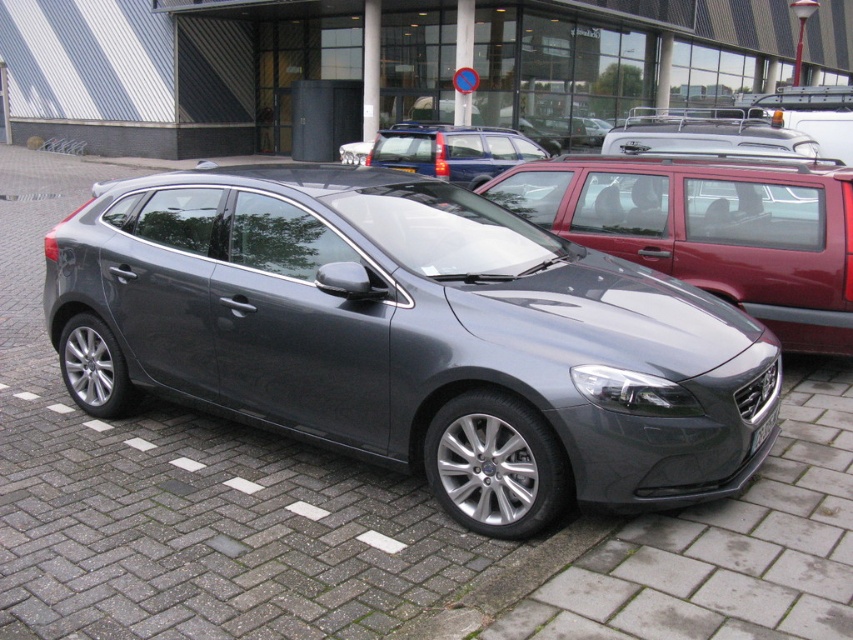
You are a delivery driver who needs to park your vehicle in this parking area. You see the satin metallic hatchback at center and the satin blue car at center. Which car is parked to the right of the other?

The satin metallic hatchback at center is positioned on the right side of the satin blue car at center.